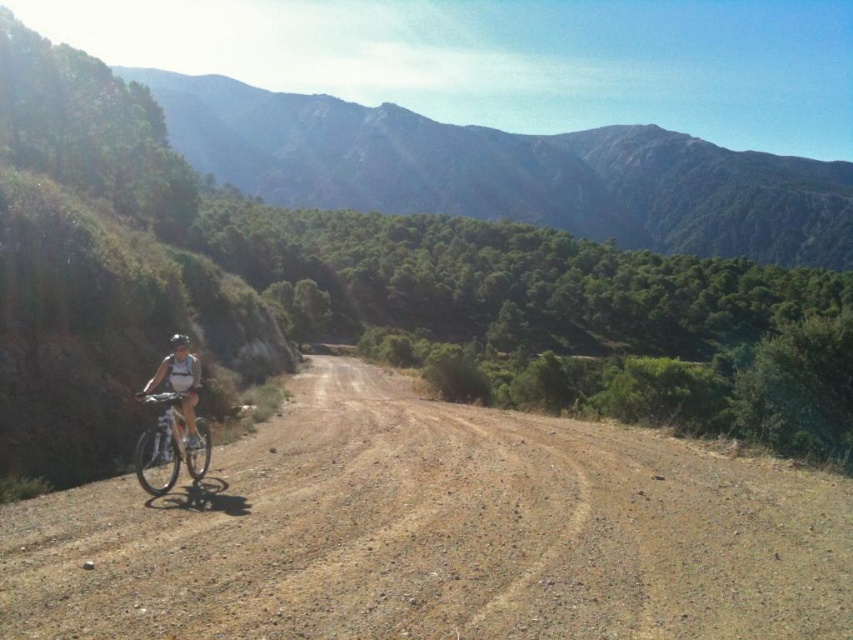
Question: Can you confirm if brown gravel dirt track at center is positioned to the left of green forested mountain at upper center?

Choices:
 (A) no
 (B) yes

Answer: (B)

Question: Does silver metallic bicycle at center have a greater width compared to white matte helmet at center?

Choices:
 (A) no
 (B) yes

Answer: (B)

Question: Which point appears farthest from the camera in this image?

Choices:
 (A) (172, 404)
 (B) (306, 524)
 (C) (694, 170)

Answer: (C)

Question: Which of the following is the closest to the observer?

Choices:
 (A) white matte helmet at center
 (B) brown gravel dirt track at center
 (C) green forested mountain at upper center

Answer: (B)

Question: Among these objects, which one is nearest to the camera?

Choices:
 (A) green forested mountain at upper center
 (B) white matte helmet at center
 (C) brown gravel dirt track at center

Answer: (C)

Question: Can you confirm if green forested mountain at upper center is thinner than silver metallic bicycle at center?

Choices:
 (A) yes
 (B) no

Answer: (B)